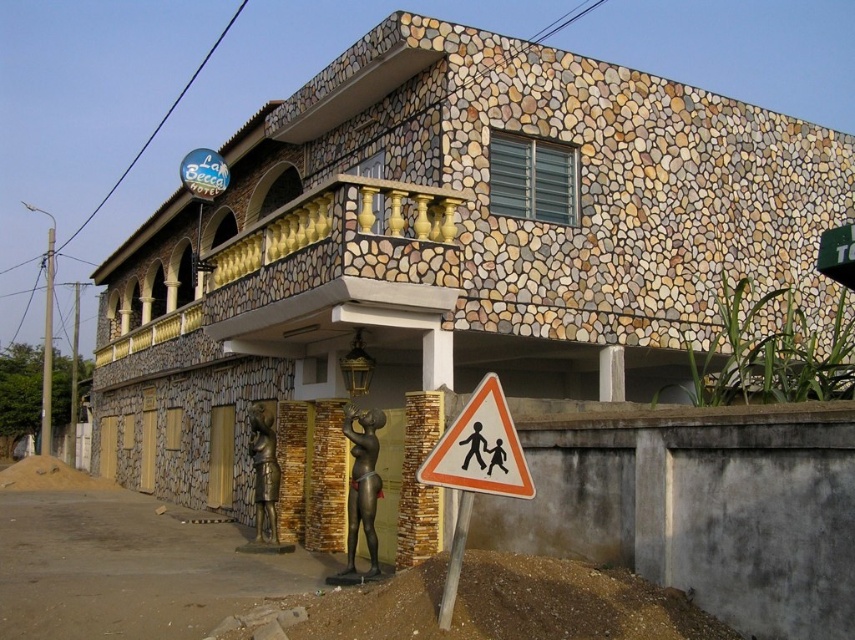
You are standing in front of the two story building and want to take a photo. You notice two points marked on the facade. The first point is at coordinate point (x=50, y=404) and the second is at point (x=463, y=508). Which point will appear closer to you in the photo?

Point (x=50, y=404) is further to the camera than point (x=463, y=508), so the point at (x=463, y=508) will appear closer to you in the photo.

What is the exact coordinate position of the bronze statue at center in the image?

The bronze statue at center is located at point (263, 470).